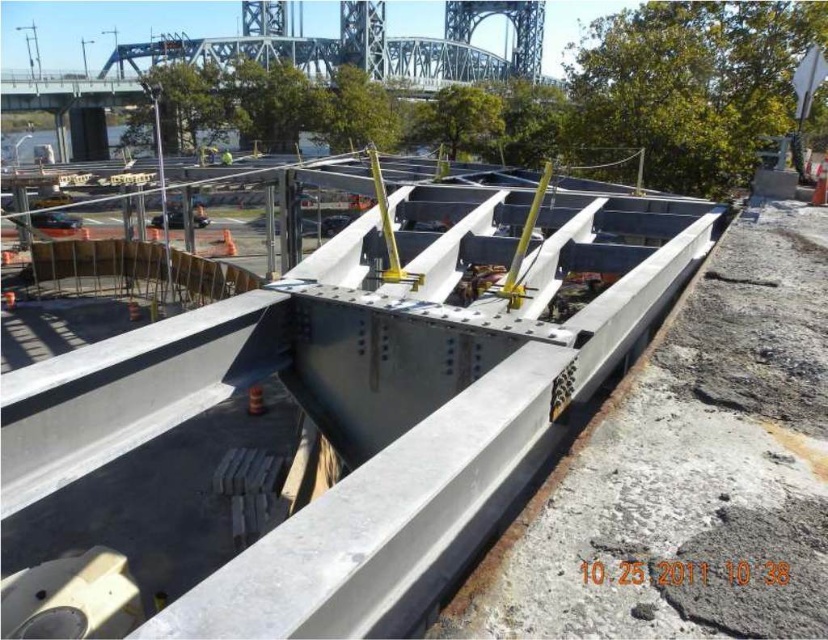
You are a construction worker standing at the edge of the bridge construction site. You notice two points marked on the steel beams. One is at coordinate point (460, 630) and the other is at point (225, 148). Which point is nearer to you as you look towards the construction site?

Point (460, 630) is closer to the viewer than point (225, 148), so the point at coordinate (460, 630) is nearer to you.

You are a safety inspector at the construction site. You notice the gray metallic beam at center and the yellow fabric construction worker at center. Which object is taller?

The yellow fabric construction worker at center is taller than the gray metallic beam at center.

You are a safety inspector at the construction site. You notice the gray metallic beam at center and the yellow fabric construction worker at center. Which object is positioned lower in the scene?

The gray metallic beam at center is located below the yellow fabric construction worker at center, so it is positioned lower in the scene.